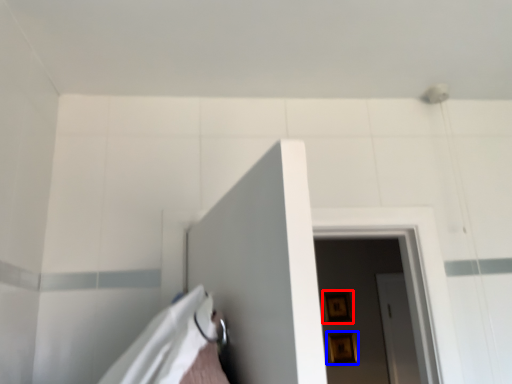
Question: Which point is further to the camera, picture frame (highlighted by a red box) or picture frame (highlighted by a blue box)?

Choices:
 (A) picture frame
 (B) picture frame

Answer: (A)